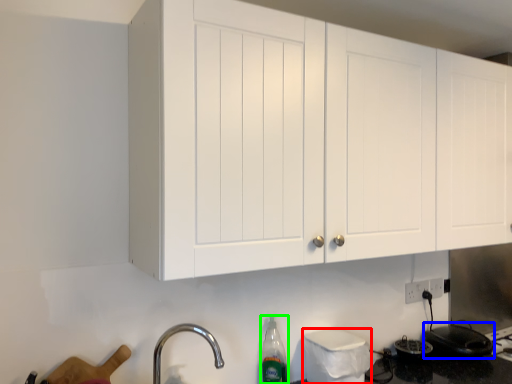
Question: Estimate the real-world distances between objects in this image. Which object is farther from appliance (highlighted by a red box), appliance (highlighted by a blue box) or bottle (highlighted by a green box)?

Choices:
 (A) appliance
 (B) bottle

Answer: (A)